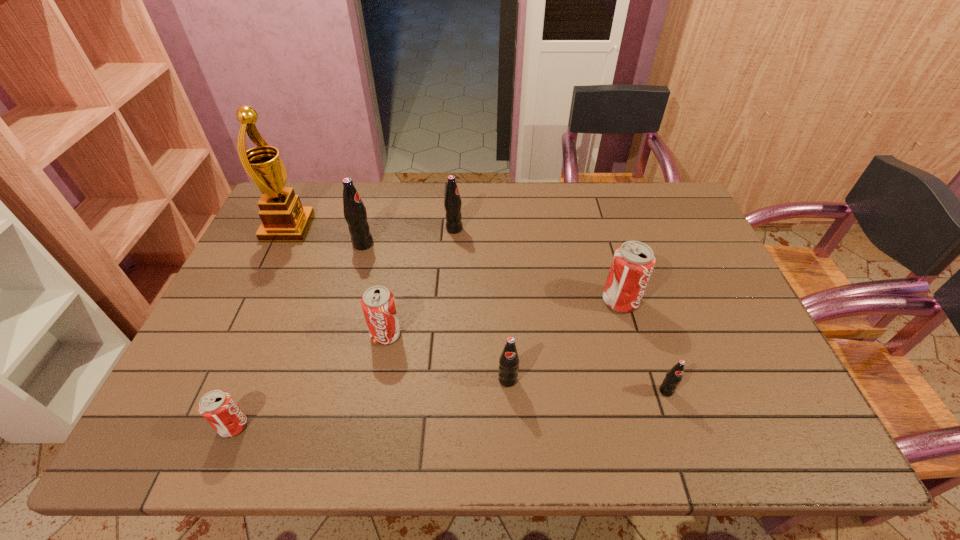
Point out which pink soda can is positioned as the second nearest to the smallest black pop. Please provide its 2D coordinates. Your answer should be formatted as a tuple, i.e. [(x, y)], where the tuple contains the x and y coordinates of a point satisfying the conditions above.

[(378, 304)]

Find the location of a particular element. The image size is (960, 540). pink soda can that can be found as the third closest to the gold award is located at coordinates (633, 262).

The image size is (960, 540). Find the location of `free space in the image that satisfies the following two spatial constraints: 1. on the front-facing side of the second pink soda can from right to left; 2. on the left side of the gold award`. free space in the image that satisfies the following two spatial constraints: 1. on the front-facing side of the second pink soda can from right to left; 2. on the left side of the gold award is located at coordinates click(238, 334).

Image resolution: width=960 pixels, height=540 pixels. I want to click on free location that satisfies the following two spatial constraints: 1. on the back side of the rightmost pink soda can; 2. on the front label of the farthest soda can, so click(x=599, y=229).

Identify the location of vacant space that satisfies the following two spatial constraints: 1. on the back side of the biggest pink soda can; 2. on the right side of the leftmost pink soda can. The width and height of the screenshot is (960, 540). tap(284, 301).

Identify the location of vacant area in the image that satisfies the following two spatial constraints: 1. on the front-facing side of the fourth farthest object; 2. on the right side of the tallest object. (253, 301).